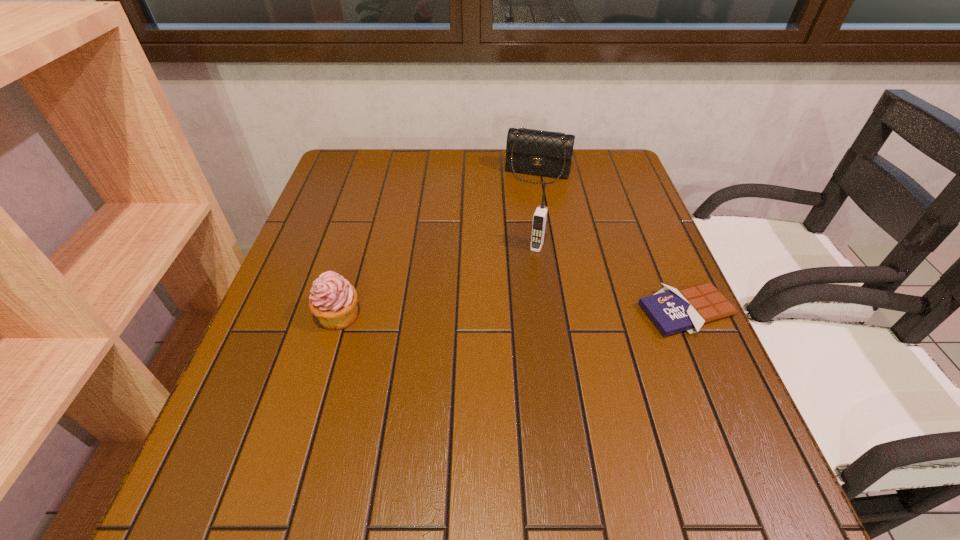
You are a GUI agent. You are given a task and a screenshot of the screen. Output one action in this format:
    pyautogui.click(x=<x>, y=<y>)
    Task: Click on the free space located on the front flap of the clutch bag
    
    Given the screenshot: What is the action you would take?
    pyautogui.click(x=521, y=216)

Locate an element on the screen. free space located 0.080m on the front-facing side of the second farthest object is located at coordinates (527, 274).

Identify the location of vacant space located 0.380m on the front-facing side of the second farthest object. (486, 380).

Where is `vacant area situated 0.180m on the front-facing side of the second farthest object`? This screenshot has height=540, width=960. vacant area situated 0.180m on the front-facing side of the second farthest object is located at coordinates (515, 305).

Identify the location of object that is at the far edge. (535, 152).

At what (x,y) coordinates should I click in order to perform the action: click on object positioned at the left edge. Please return your answer as a coordinate pair (x, y). Looking at the image, I should click on (333, 300).

You are a GUI agent. You are given a task and a screenshot of the screen. Output one action in this format:
    pyautogui.click(x=<x>, y=<y>)
    Task: Click on the object that is at the right edge
    Image resolution: width=960 pixels, height=540 pixels.
    Given the screenshot: What is the action you would take?
    pyautogui.click(x=672, y=311)

At what (x,y) coordinates should I click in order to perform the action: click on free region at the far edge of the desktop. Please return your answer as a coordinate pair (x, y). Looking at the image, I should click on (475, 153).

What are the coordinates of `blank space at the near edge of the desktop` in the screenshot? It's located at (538, 435).

Find the location of `free point at the left edge`. free point at the left edge is located at coordinates (280, 301).